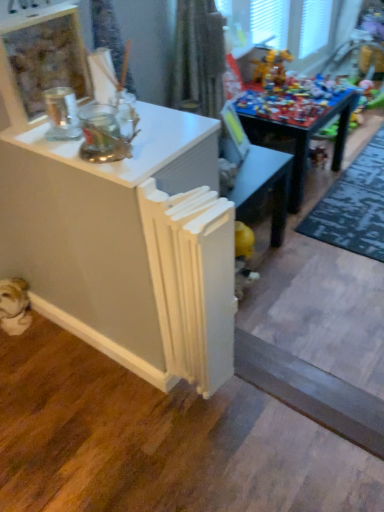
Question: From the image's perspective, is white matte radiator at center positioned above or below clear glass jar at upper left?

Choices:
 (A) below
 (B) above

Answer: (A)

Question: Is white matte radiator at center inside the boundaries of clear glass jar at upper left, or outside?

Choices:
 (A) inside
 (B) outside

Answer: (B)

Question: Which of these objects is positioned closest to the white fur dog at lower left?

Choices:
 (A) wooden toy at center
 (B) white matte radiator at center
 (C) shiny plastic toy at upper right
 (D) green textured rug at lower right
 (E) clear glass jar at upper left

Answer: (B)

Question: Estimate the real-world distances between objects in this image. Which object is closer to the gray matte wood plank at lower right?

Choices:
 (A) shiny plastic toy at upper right
 (B) white fur dog at lower left
 (C) white matte radiator at center
 (D) green textured rug at lower right
 (E) clear glass jar at upper left

Answer: (C)